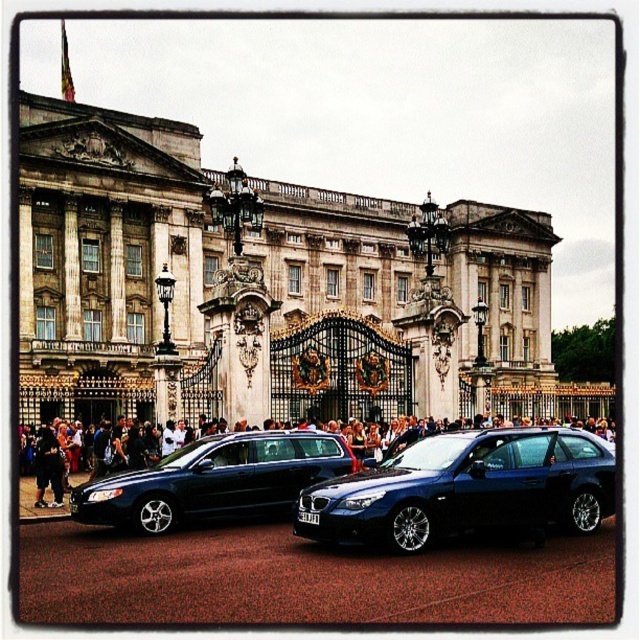
Question: Estimate the real-world distances between objects in this image. Which object is farther from the shiny blue car at center?

Choices:
 (A) stone marble palace at center
 (B) shiny black sedan at center

Answer: (A)

Question: Can you confirm if shiny blue car at center is bigger than shiny black sedan at center?

Choices:
 (A) no
 (B) yes

Answer: (B)

Question: Can you confirm if stone marble palace at center is positioned above shiny blue car at center?

Choices:
 (A) yes
 (B) no

Answer: (A)

Question: Which object appears closest to the camera in this image?

Choices:
 (A) stone marble palace at center
 (B) shiny black sedan at center

Answer: (B)

Question: From the image, what is the correct spatial relationship of stone marble palace at center in relation to shiny black sedan at center?

Choices:
 (A) below
 (B) above

Answer: (B)

Question: Considering the real-world distances, which object is farthest from the shiny black sedan at center?

Choices:
 (A) stone marble palace at center
 (B) shiny blue car at center

Answer: (A)